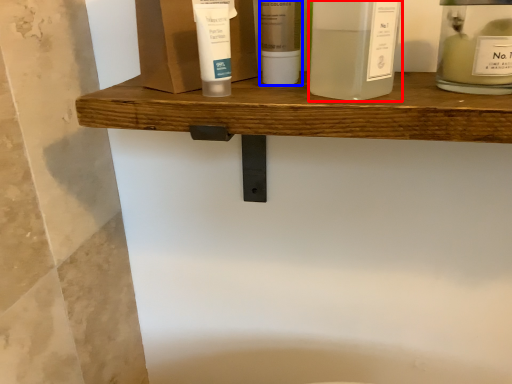
Question: Which point is closer to the camera, product (highlighted by a red box) or toiletry (highlighted by a blue box)?

Choices:
 (A) product
 (B) toiletry

Answer: (A)